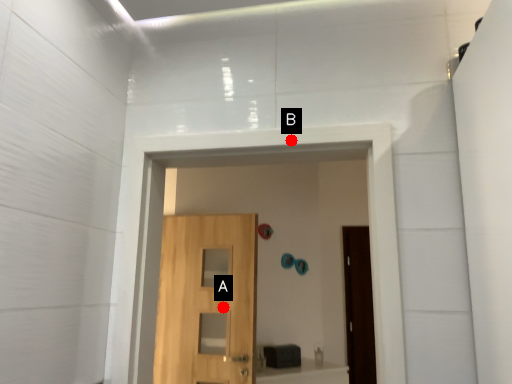
Question: Two points are circled on the image, labeled by A and B beside each circle. Which of the following is the farthest from the observer?

Choices:
 (A) A is further
 (B) B is further

Answer: (A)